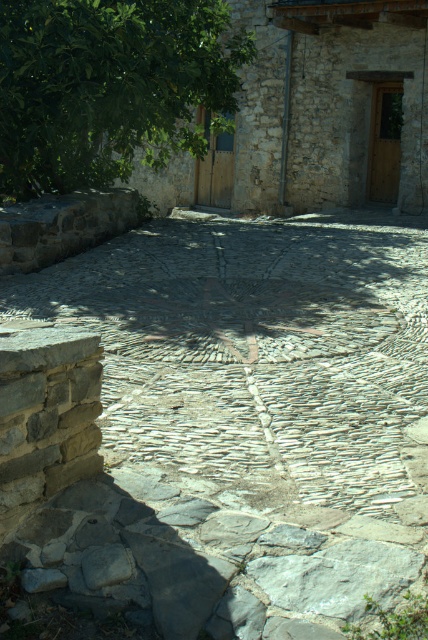
Can you confirm if natural stone path at center is smaller than green leafy tree at upper left?

No.

Who is more forward, (270, 240) or (0, 84)?

Positioned in front is point (0, 84).

I want to click on natural stone path at center, so point(255,353).